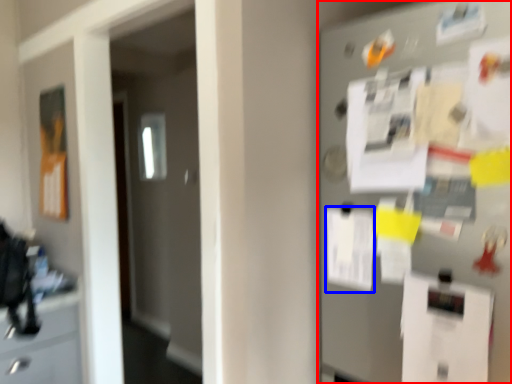
Question: Which object appears closest to the camera in this image, fridge (highlighted by a red box) or paper (highlighted by a blue box)?

Choices:
 (A) fridge
 (B) paper

Answer: (A)